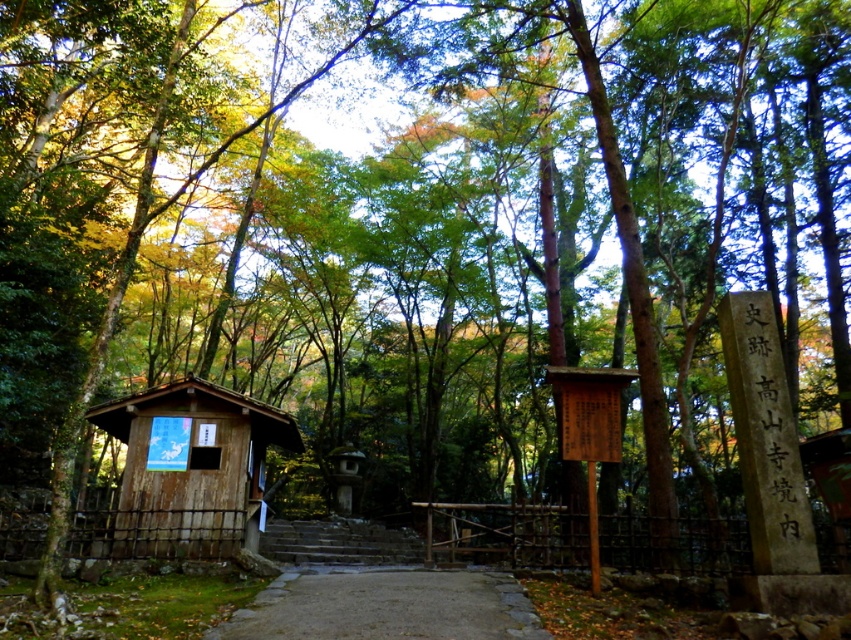
You are a tourist visiting the temple and want to walk from the entrance to the pavilion. You see the smooth stone path at center and the stone steps at center. Which one should you follow to reach the pavilion?

The smooth stone path at center is to the right of the stone steps at center. Since the path leads towards the pavilion, you should follow the smooth stone path at center.

You are a tour guide leading a group through the temple grounds. You need to ensure that a wheelchair can navigate between the wooden hut at center and the smooth stone path at center. The wheelchair requires a minimum clearance of 2 meters. Is the distance sufficient?

The distance between the wooden hut at center and the smooth stone path at center is 2.34 meters, which exceeds the required 2 meters clearance. Therefore, the wheelchair can navigate between them.